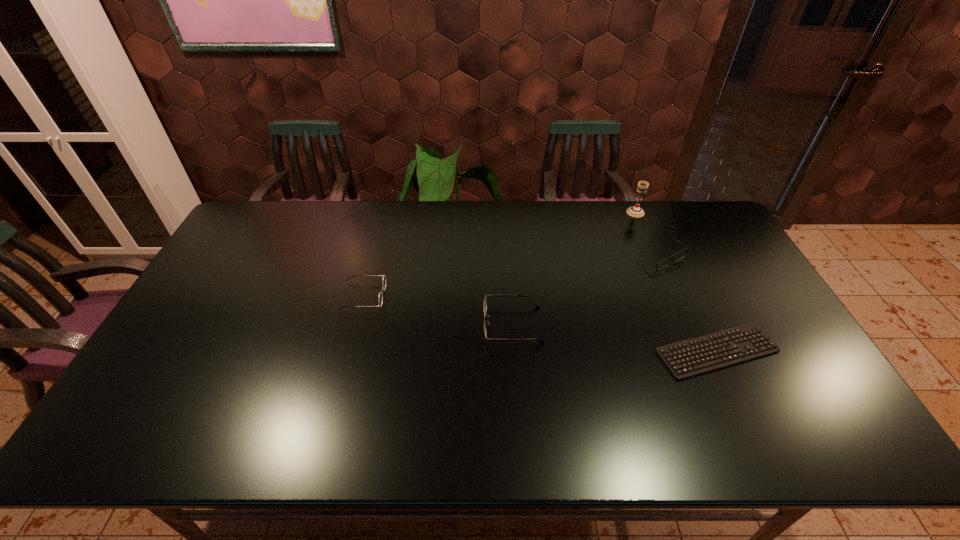
Find the location of a particular element. The width and height of the screenshot is (960, 540). vacant space located 0.090m on the front-facing side of the leftmost object is located at coordinates (415, 296).

You are a GUI agent. You are given a task and a screenshot of the screen. Output one action in this format:
    pyautogui.click(x=<x>, y=<y>)
    Task: Click on the free space located on the front-facing side of the fourth tallest object
    Image resolution: width=960 pixels, height=540 pixels.
    Given the screenshot: What is the action you would take?
    pyautogui.click(x=388, y=325)

Locate an element on the screen. The height and width of the screenshot is (540, 960). vacant region located on the front-facing side of the fourth tallest object is located at coordinates (364, 325).

The width and height of the screenshot is (960, 540). What are the coordinates of `vacant space located on the front-facing side of the fourth tallest object` in the screenshot? It's located at (455, 325).

What are the coordinates of `free space located on the left of the computer keyboard` in the screenshot? It's located at (633, 351).

Locate an element on the screen. This screenshot has height=540, width=960. object at the far edge is located at coordinates (635, 211).

Where is `object that is at the right edge`? The image size is (960, 540). object that is at the right edge is located at coordinates (751, 328).

In the image, there is a desktop. What are the coordinates of `vacant region at the far edge` in the screenshot? It's located at (556, 238).

Image resolution: width=960 pixels, height=540 pixels. What are the coordinates of `vacant space at the near edge of the desktop` in the screenshot? It's located at (200, 421).

Locate an element on the screen. This screenshot has height=540, width=960. vacant space at the left edge of the desktop is located at coordinates (180, 334).